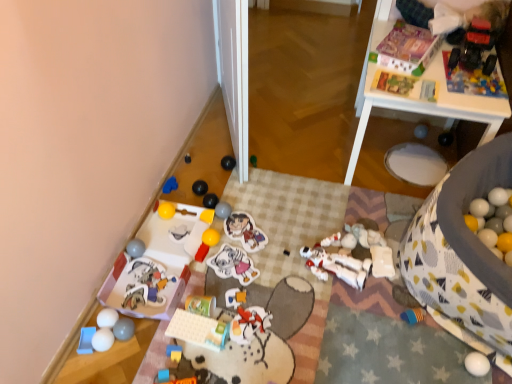
The width and height of the screenshot is (512, 384). In order to click on vacant area that lies between matte plastic sticker at center, the seventh toy when ordered from right to left, and white matte doll at center, acting as the 5th toy starting from the right in this screenshot , I will do `click(280, 247)`.